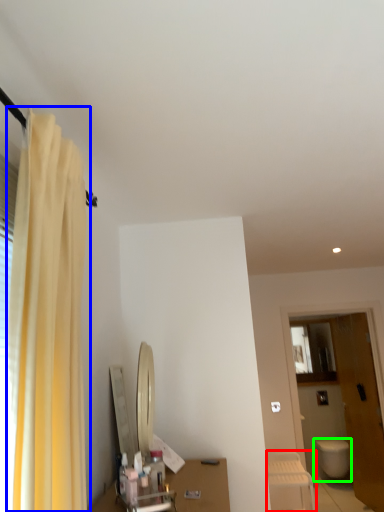
Question: Considering the real-world distances, which object is closest to furniture (highlighted by a red box)? curtain (highlighted by a blue box) or toilet (highlighted by a green box).

Choices:
 (A) curtain
 (B) toilet

Answer: (B)